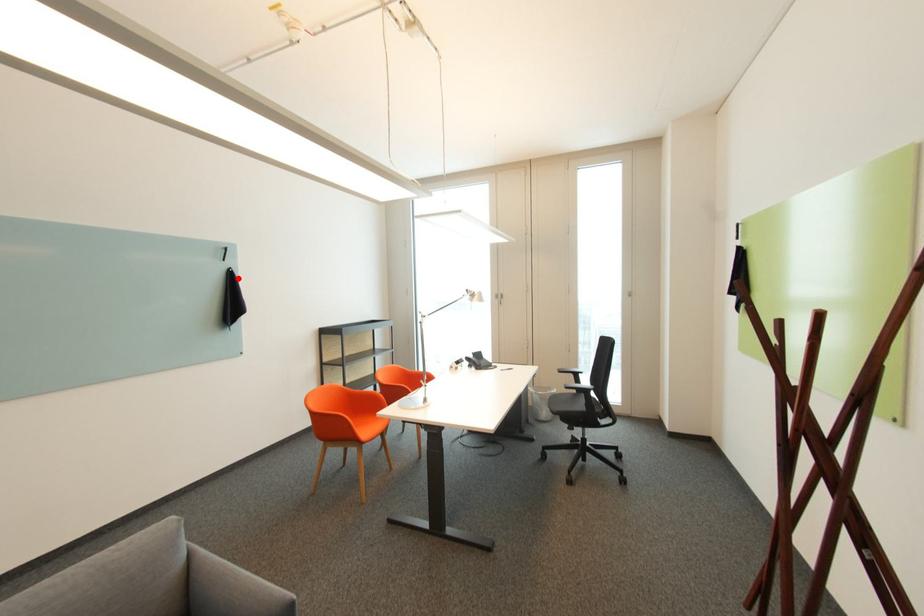
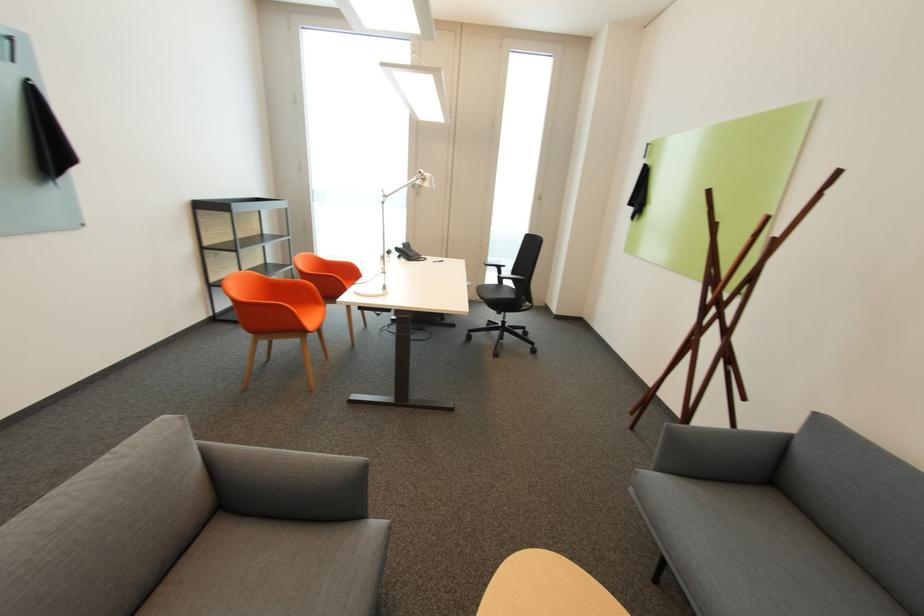
Question: I am providing you with two images of the same scene from different viewpoints. Given a red point in image1, look at the same physical point in image2. Is it:

Choices:
 (A) Closer to the viewpoint
 (B) Farther from the viewpoint

Answer: (B)